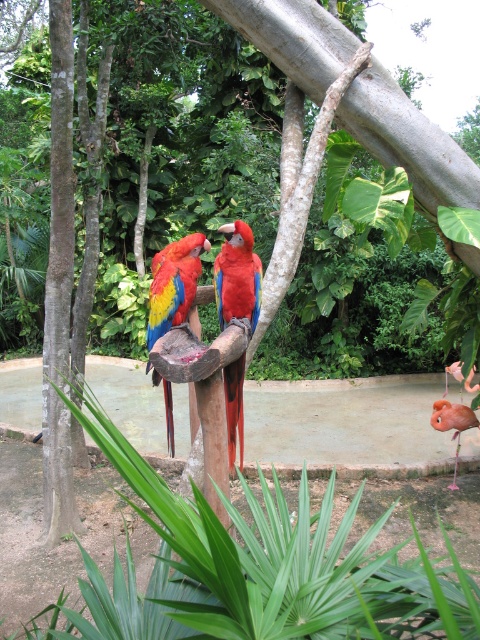
Question: Does shiny red parrot at center have a lesser width compared to shiny multicolored parrot at center?

Choices:
 (A) yes
 (B) no

Answer: (A)

Question: Which is farther from the shiny red parrot at center?

Choices:
 (A) matte pink flamingo at lower right
 (B) shiny multicolored parrot at center

Answer: (A)

Question: Is shiny red parrot at center wider than shiny multicolored parrot at center?

Choices:
 (A) no
 (B) yes

Answer: (A)

Question: Which point appears closest to the camera in this image?

Choices:
 (A) (146, 333)
 (B) (459, 413)
 (C) (228, 291)

Answer: (C)

Question: Considering the real-world distances, which object is farthest from the matte pink flamingo at lower right?

Choices:
 (A) shiny multicolored parrot at center
 (B) shiny red parrot at center

Answer: (A)

Question: Does shiny red parrot at center have a lesser width compared to shiny multicolored parrot at center?

Choices:
 (A) yes
 (B) no

Answer: (A)